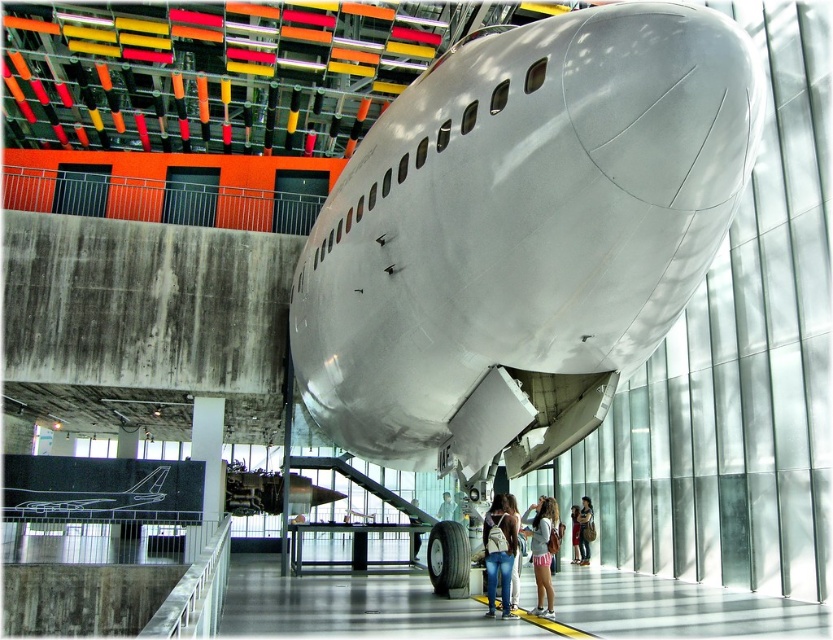
You are a fashion designer standing in the aircraft museum and you see two pairs of jeans, the denim jeans at center and the light blue jeans at center. You want to place a new accessory between them. Is there enough space to place it?

The distance between denim jeans at center and light blue jeans at center is 23.08 meters, so there is sufficient space to place an accessory between them.

You are standing in the museum facing the aircraft nose. You see two points marked on the floor. The first point is at coordinate point(489,563) and the second point is at point(452,513). Which point is closer to the aircraft nose?

Point(489,563) is in front of point(452,513), so it is closer to the aircraft nose.

You are a museum guide explaining the layout of the exhibition. Where is the polished aluminum airplane at center positioned relative to the colorful light fixtures on the ceiling?

The polished aluminum airplane at center is positioned below the colorful light fixtures on the ceiling since it is located at point coordinates lower than the ceiling fixtures.